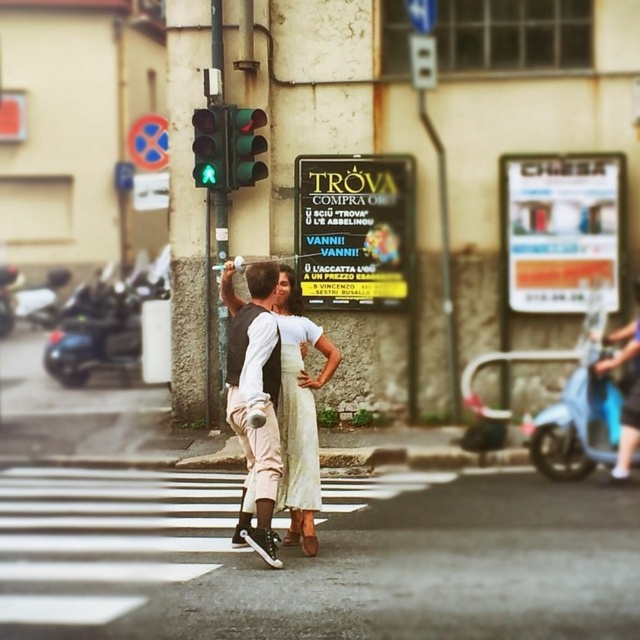
You are a fashion designer observing the urban street scene. You notice the matte black vest at center and the light beige fabric dress at center. Which clothing item appears narrower when viewed from your perspective?

The matte black vest at center appears narrower than the light beige fabric dress at center because it has a lesser width compared to it.

You are a photographer trying to capture both the matte black vest at center and the green glass traffic light at upper center in a single frame. Based on their sizes, which object should you focus on first to ensure both are in the frame?

The matte black vest at center is taller than the green glass traffic light at upper center, so you should focus on the matte black vest at center first to ensure both fit in the frame.

You are a pedestrian trying to cross the street and notice the green glass traffic light at upper center and the metallic pole at center. Which object is closer to you?

The green glass traffic light at upper center is closer to you because it is in front of the metallic pole at center.